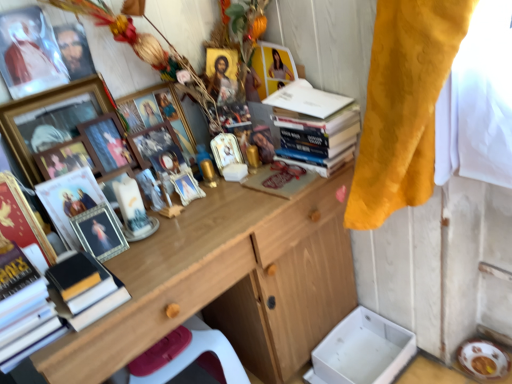
The width and height of the screenshot is (512, 384). In order to click on vacant space to the right of hardcover book at left, the 2th book in the top-to-bottom sequence in this screenshot , I will do `click(159, 267)`.